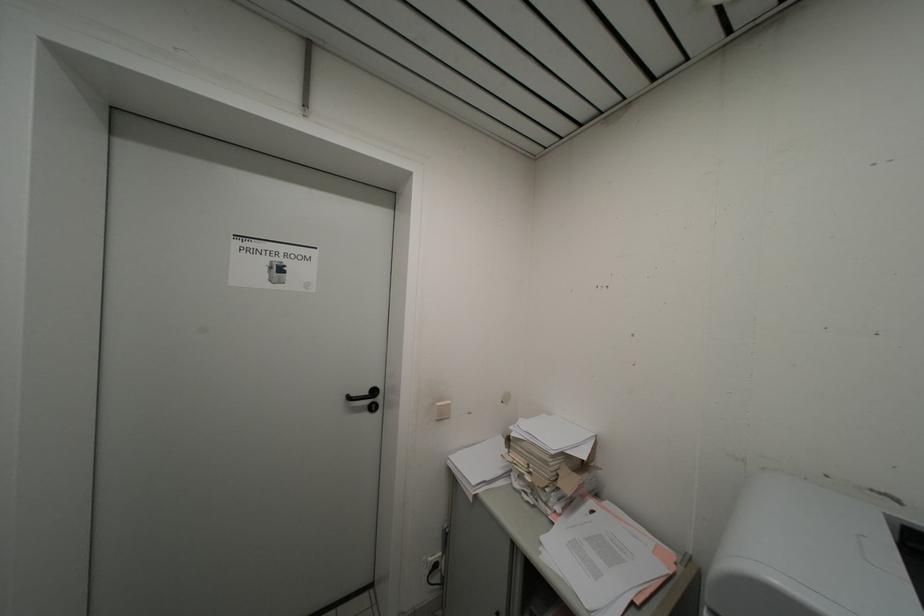
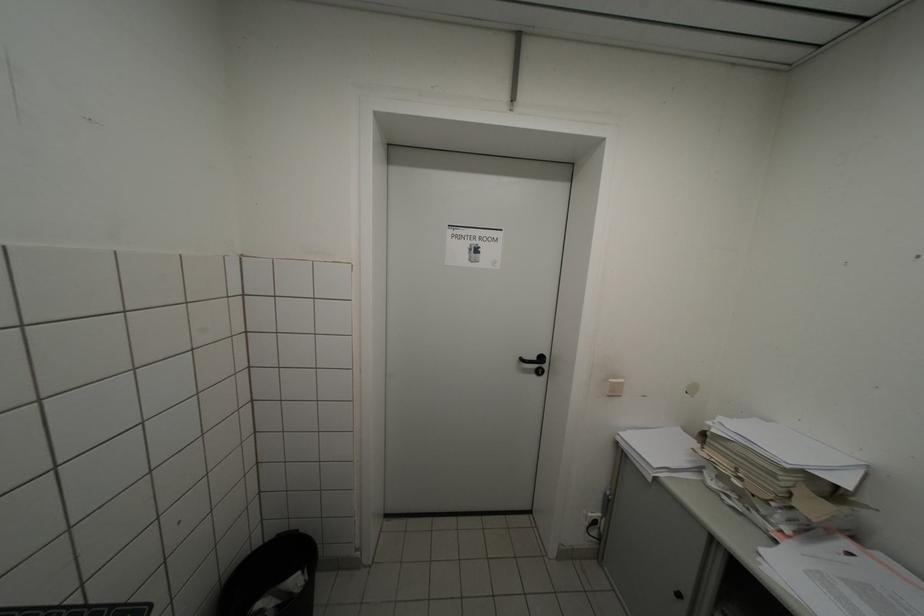
In the second image, find the point that corresponds to the point at 445,407 in the first image.

(618, 383)